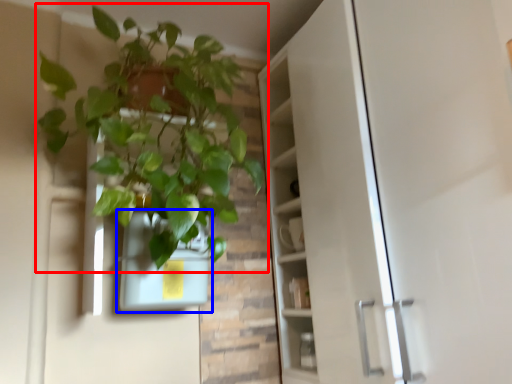
Question: Among these objects, which one is nearest to the camera, houseplant (highlighted by a red box) or flowerpot (highlighted by a blue box)?

Choices:
 (A) houseplant
 (B) flowerpot

Answer: (A)